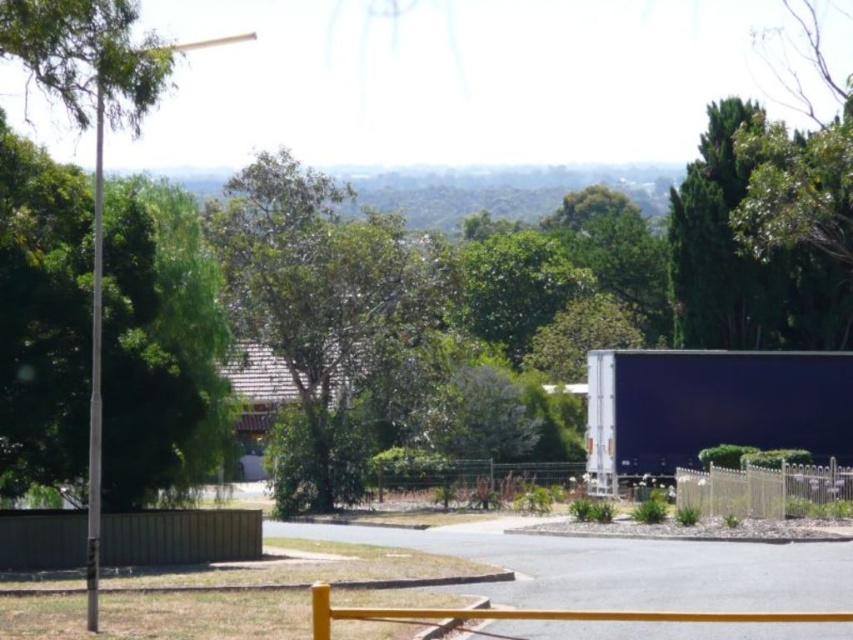
Question: Is green leafy tree at center smaller than white metal fence at lower right?

Choices:
 (A) yes
 (B) no

Answer: (B)

Question: Which point appears farthest from the camera in this image?

Choices:
 (A) click(x=244, y=540)
 (B) click(x=67, y=186)

Answer: (A)

Question: Considering the real-world distances, which object is farthest from the green leafy tree at left?

Choices:
 (A) green leafy tree at center
 (B) white metal fence at lower right
 (C) metallic wire fence at center

Answer: (A)

Question: Which object is positioned closest to the white metal fence at lower right?

Choices:
 (A) green leafy tree at left
 (B) green leafy tree at center

Answer: (B)

Question: Does green leafy tree at left appear over green leafy tree at center?

Choices:
 (A) no
 (B) yes

Answer: (A)

Question: Is green leafy tree at center below metallic wire fence at center?

Choices:
 (A) no
 (B) yes

Answer: (A)